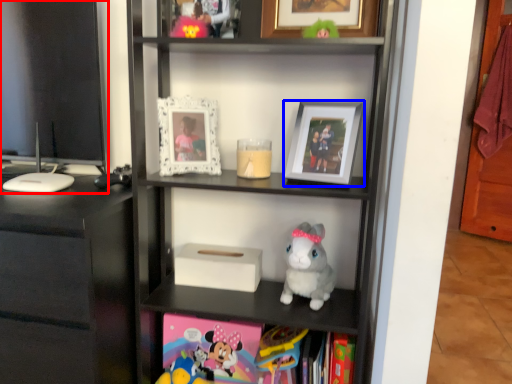
Question: Which object is further to the camera taking this photo, computer monitor (highlighted by a red box) or picture frame (highlighted by a blue box)?

Choices:
 (A) computer monitor
 (B) picture frame

Answer: (A)